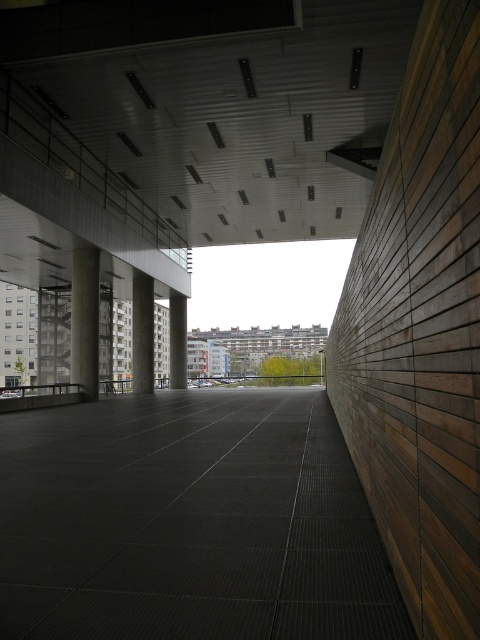
You are a delivery robot with a turning radius of 10 feet. You need to navigate from the entrance to the dark gray concrete corridor at center while avoiding the concrete column at center. Can you safely maneuver around the column?

The distance between the dark gray concrete corridor at center and the concrete column at center is 40.55 feet. Since your turning radius is only 10 feet, you have ample space to safely navigate around the column without any collision.

You are navigating through an urban space and need to locate the dark gray concrete corridor at center. According to the scene, where is it situated relative to the matte gray concrete pillar at center?

The dark gray concrete corridor at center is positioned on the right side of the matte gray concrete pillar at center.

You are standing at the origin point in the urban scene. Which direction should you move to reach the dark gray concrete corridor at center?

The dark gray concrete corridor at center is located at coordinates point (189, 522), so you should move towards the right and slightly upwards from your current position at the origin point.